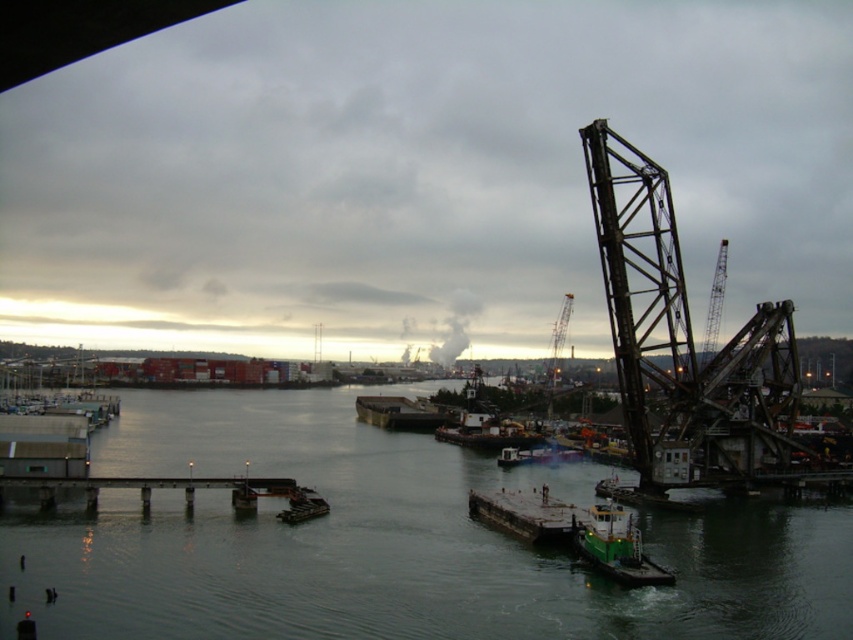
You are a delivery drone flying at an altitude of 50 meters above the industrial waterfront scene. You need to land precisely on the green matte boat at center. What are the coordinates you should target for your landing zone?

The coordinates for the green matte boat at center are point (303, 506), so you should target those coordinates for your landing zone.

You are a delivery worker needing to transport a 3m wide cargo container. You see the concrete pier at lower center and the green matte boat at center. Which location can accommodate the cargo container based on their widths?

The concrete pier at lower center has a greater width than the green matte boat at center, so the cargo container can be placed on the concrete pier at lower center.